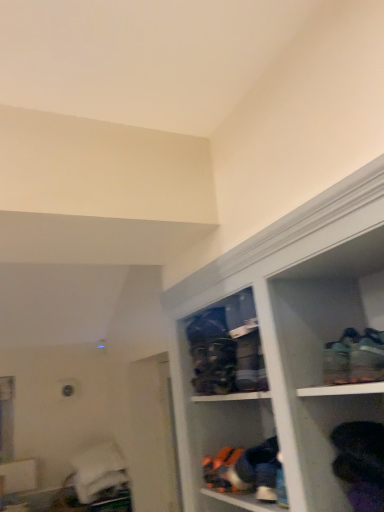
This screenshot has height=512, width=384. Find the location of `matte plastic shoe rack at center`. matte plastic shoe rack at center is located at coordinates (226, 347).

The image size is (384, 512). Describe the element at coordinates (339, 447) in the screenshot. I see `black fabric shoes at lower right` at that location.

This screenshot has width=384, height=512. What are the coordinates of `black fabric shoes at lower right` in the screenshot? It's located at (339, 447).

The width and height of the screenshot is (384, 512). I want to click on green fabric shoe at upper right, so click(x=354, y=358).

Is point (327, 442) positioned after point (212, 376)?

No.

From the image's perspective, is black fabric shoes at lower right located above matte plastic shoe rack at center?

No, from the image's perspective, black fabric shoes at lower right is not over matte plastic shoe rack at center.

From their relative heights in the image, would you say black fabric shoes at lower right is taller or shorter than matte plastic shoe rack at center?

In the image, black fabric shoes at lower right appears to be shorter than matte plastic shoe rack at center.

Considering the sizes of objects matte plastic shoe rack at center and green fabric shoe at upper right in the image provided, who is thinner, matte plastic shoe rack at center or green fabric shoe at upper right?

With smaller width is matte plastic shoe rack at center.

Does point (235, 315) come in front of point (328, 343)?

No.

Is matte plastic shoe rack at center in front of or behind green fabric shoe at upper right in the image?

matte plastic shoe rack at center is positioned farther from the viewer than green fabric shoe at upper right.

Considering the relative positions of matte plastic shoe rack at center and green fabric shoe at upper right in the image provided, is matte plastic shoe rack at center to the right of green fabric shoe at upper right from the viewer's perspective?

No.

Is green fabric shoe at upper right in front of or behind black fabric shoes at lower right in the image?

Clearly, green fabric shoe at upper right is behind black fabric shoes at lower right.

From a real-world perspective, is green fabric shoe at upper right positioned over black fabric shoes at lower right based on gravity?

Yes, from a real-world perspective, green fabric shoe at upper right is above black fabric shoes at lower right.

Which is in front, point (365, 332) or point (325, 465)?

The point (365, 332) is in front.

Can you confirm if green fabric shoe at upper right is thinner than black fabric shoes at lower right?

In fact, green fabric shoe at upper right might be wider than black fabric shoes at lower right.

Choose the correct answer: Is black fabric shoes at lower right inside green fabric shoe at upper right or outside it?

black fabric shoes at lower right is not enclosed by green fabric shoe at upper right.

Is point (365, 406) behind point (373, 380)?

Yes.

Where is `shelf below the green fabric shoe at upper right (from a real-world perspective)`? This screenshot has width=384, height=512. shelf below the green fabric shoe at upper right (from a real-world perspective) is located at coordinates (339, 447).

How different are the orientations of black fabric shoes at lower right and green fabric shoe at upper right in degrees?

There is a 0.000596-degree angle between the facing directions of black fabric shoes at lower right and green fabric shoe at upper right.

Is matte plastic shoe rack at center located within green fabric shoe at upper right?

Actually, matte plastic shoe rack at center is outside green fabric shoe at upper right.

Which of these two, green fabric shoe at upper right or matte plastic shoe rack at center, is bigger?

With larger size is matte plastic shoe rack at center.

Which is closer to the camera, (325, 352) or (238, 320)?

Point (325, 352) is positioned closer to the camera compared to point (238, 320).

Considering the sizes of objects matte plastic shoe rack at center and black fabric shoes at lower right in the image provided, who is shorter, matte plastic shoe rack at center or black fabric shoes at lower right?

With less height is black fabric shoes at lower right.

Consider the image. From a real-world perspective, which object rests below the other?

From a 3D spatial view, black fabric shoes at lower right is below.

Which is correct: matte plastic shoe rack at center is inside black fabric shoes at lower right, or outside of it?

matte plastic shoe rack at center is not inside black fabric shoes at lower right, it's outside.

In order to click on cabinet on the left side of black fabric shoes at lower right in this screenshot , I will do `click(226, 347)`.

The image size is (384, 512). What are the coordinates of `cabinet that appears above the black fabric shoes at lower right (from the image's perspective)` in the screenshot? It's located at (226, 347).

Where is `cabinet above the green fabric shoe at upper right (from a real-world perspective)`? Image resolution: width=384 pixels, height=512 pixels. cabinet above the green fabric shoe at upper right (from a real-world perspective) is located at coordinates (226, 347).

When comparing their distances from matte plastic shoe rack at center, does green fabric shoe at upper right or black fabric shoes at lower right seem further?

Among the two, green fabric shoe at upper right is located further to matte plastic shoe rack at center.

Based on their spatial positions, is green fabric shoe at upper right or matte plastic shoe rack at center further from black fabric shoes at lower right?

Among the two, matte plastic shoe rack at center is located further to black fabric shoes at lower right.

From the image, which object appears to be nearer to green fabric shoe at upper right, black fabric shoes at lower right or matte plastic shoe rack at center?

Based on the image, black fabric shoes at lower right appears to be nearer to green fabric shoe at upper right.

From the image, which object appears to be farther from black fabric shoes at lower right, matte plastic shoe rack at center or green fabric shoe at upper right?

matte plastic shoe rack at center.

Based on their spatial positions, is black fabric shoes at lower right or green fabric shoe at upper right further from matte plastic shoe rack at center?

Among the two, green fabric shoe at upper right is located further to matte plastic shoe rack at center.

Based on the photo, estimate the real-world distances between objects in this image. Which object is closer to green fabric shoe at upper right, matte plastic shoe rack at center or black fabric shoes at lower right?

black fabric shoes at lower right.

In order to click on footwear between black fabric shoes at lower right and matte plastic shoe rack at center from front to back in this screenshot , I will do `click(354, 358)`.